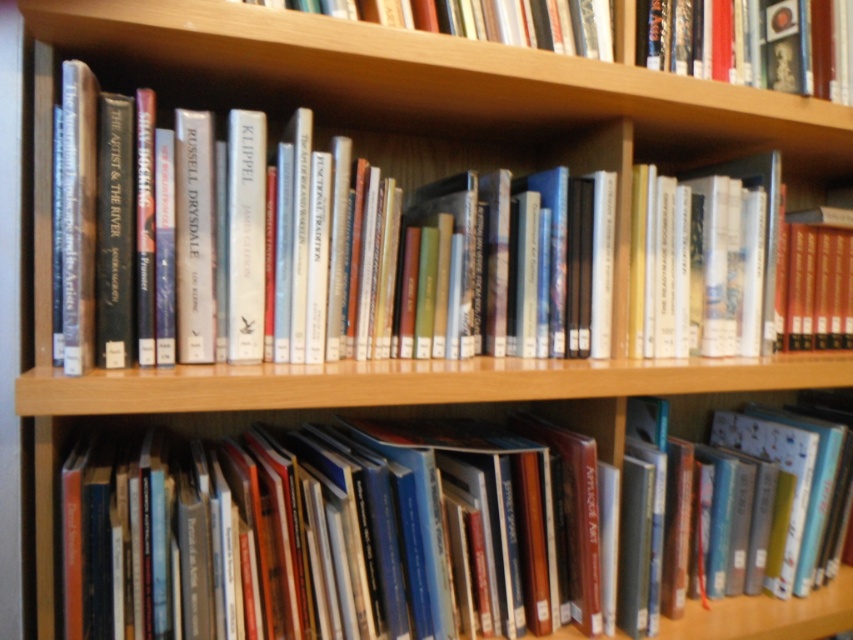
Question: Is hardcover book at upper right further to the viewer compared to hardcover book at lower center?

Choices:
 (A) no
 (B) yes

Answer: (B)

Question: Considering the real-world distances, which object is closest to the hardcover book at lower center?

Choices:
 (A) hardcover book at upper right
 (B) hardcover books at center

Answer: (A)

Question: Among these objects, which one is farthest from the camera?

Choices:
 (A) hardcover books at center
 (B) hardcover book at lower center
 (C) hardcover book at upper right

Answer: (C)

Question: Is hardcover book at lower center above hardcover books at center?

Choices:
 (A) yes
 (B) no

Answer: (B)

Question: Based on their relative distances, which object is farther from the hardcover books at center?

Choices:
 (A) hardcover book at lower center
 (B) hardcover book at upper right

Answer: (B)

Question: Can you confirm if hardcover book at lower center is thinner than hardcover books at center?

Choices:
 (A) yes
 (B) no

Answer: (B)